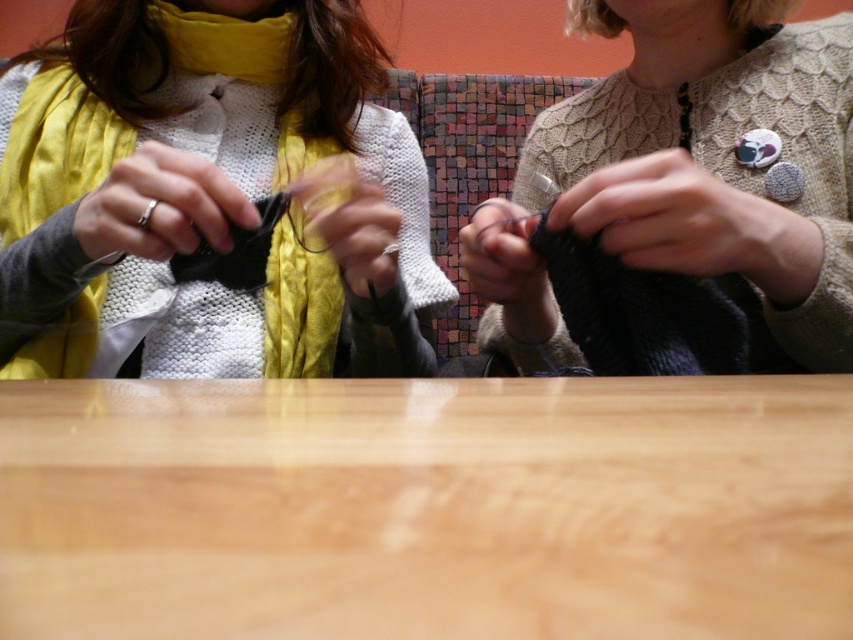
You are a tailor who needs to measure the distance between the knitted beige sweater at center and the edge of the table to ensure there is enough space to place a 20 inch ruler. Based on the scene, can you fit the ruler horizontally next to the sweater?

The distance between the knitted beige sweater at center and the viewer is 19.72 inches. Since the ruler is 20 inches long, it might not fit horizontally if the available space is slightly less than 20 inches. However, the description only provides the distance to the viewer, not the space next to the sweater. Without knowing the exact space between the sweater and the table edge, it is uncertain if the ruler will fit.